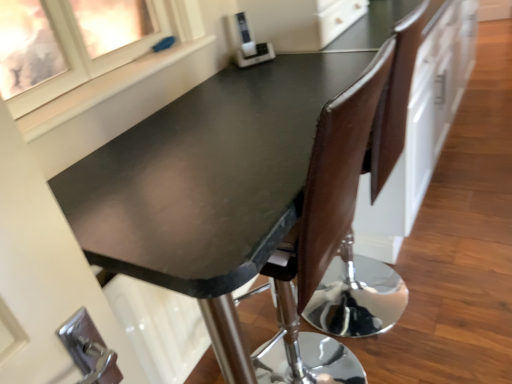
The image size is (512, 384). I want to click on free location above white smooth window sill at upper left (from a real-world perspective), so click(133, 73).